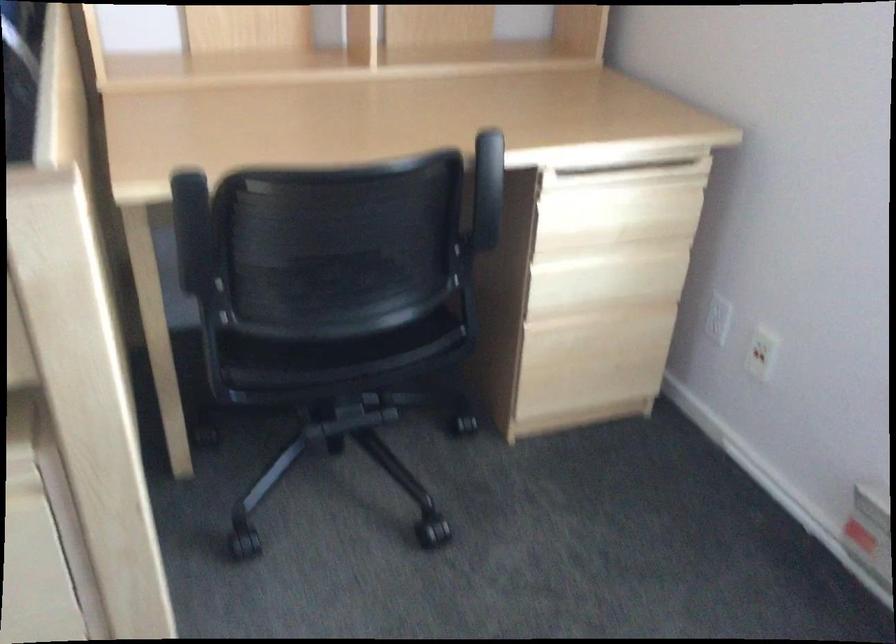
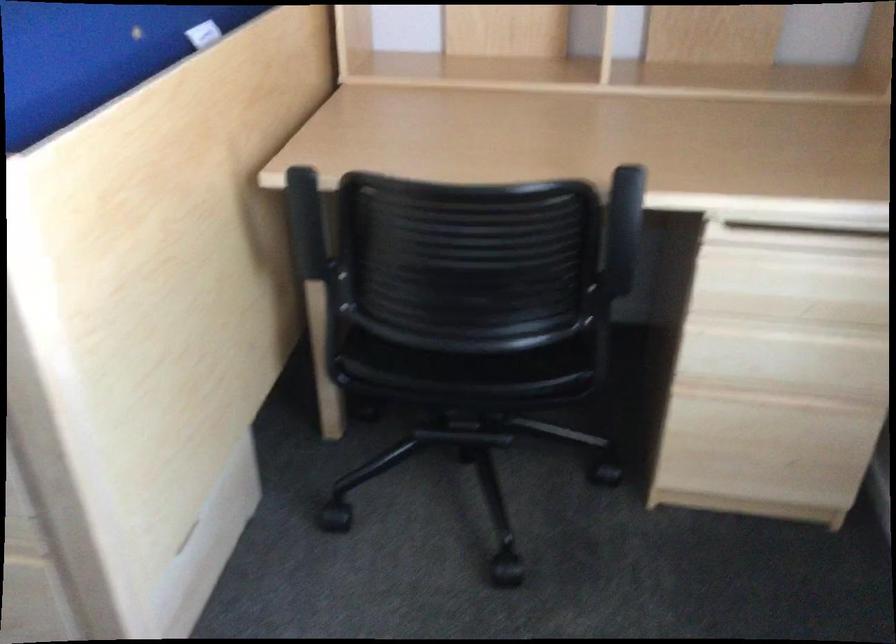
The point at (489, 198) is marked in the first image. Where is the corresponding point in the second image?

(625, 240)